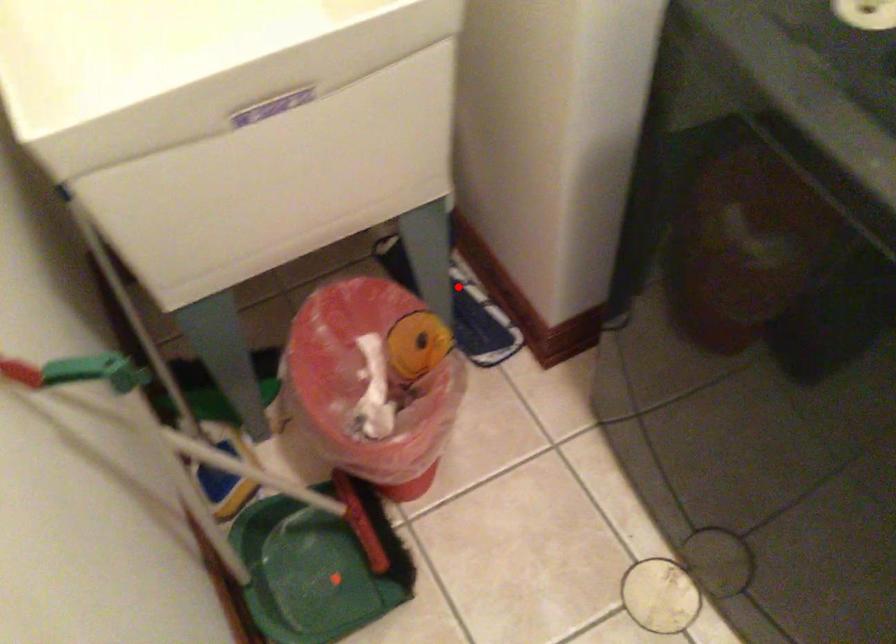
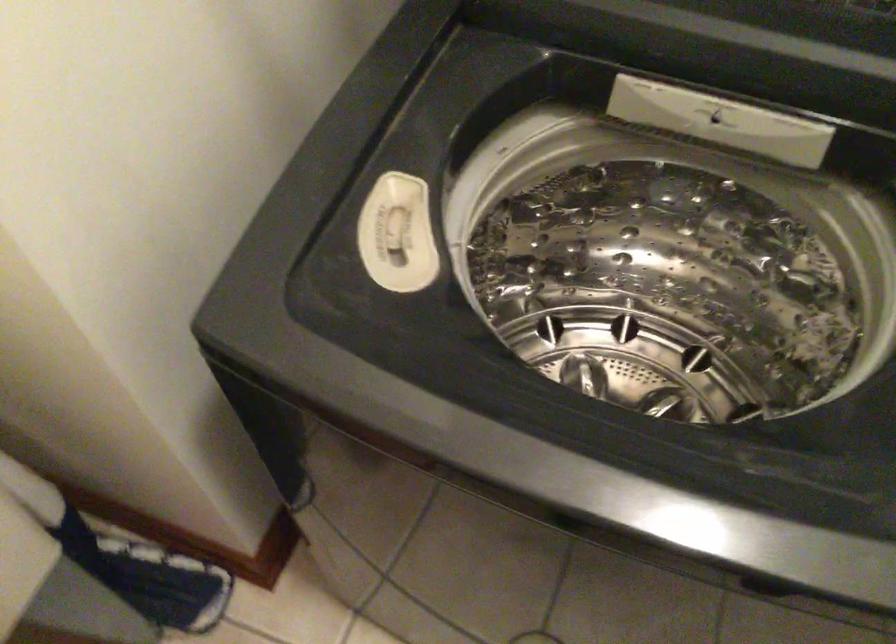
Question: I am providing you with two images of the same scene from different viewpoints. In image1, a red point is highlighted. Considering the same 3D point in image2, which of the following is correct?

Choices:
 (A) It is closer
 (B) It is farther

Answer: (A)